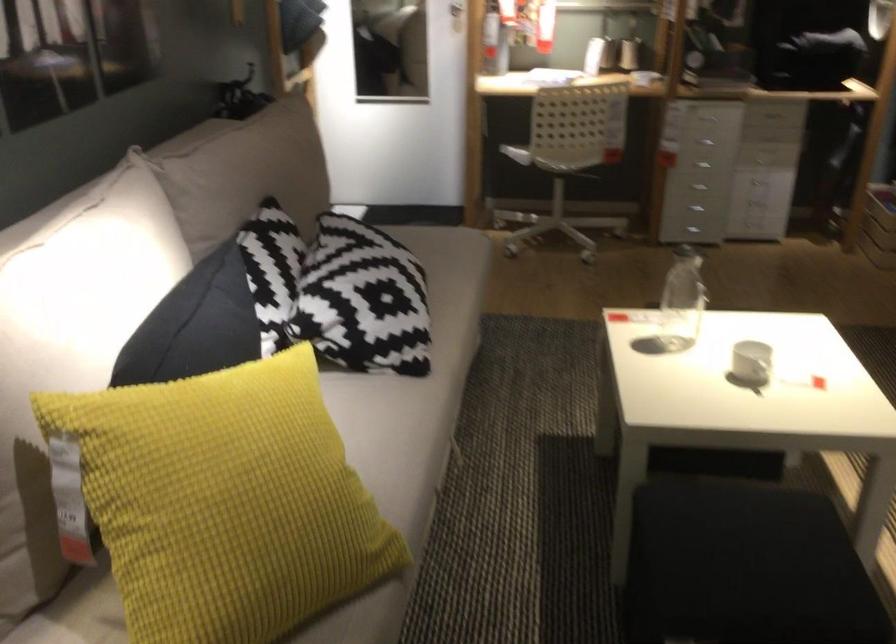
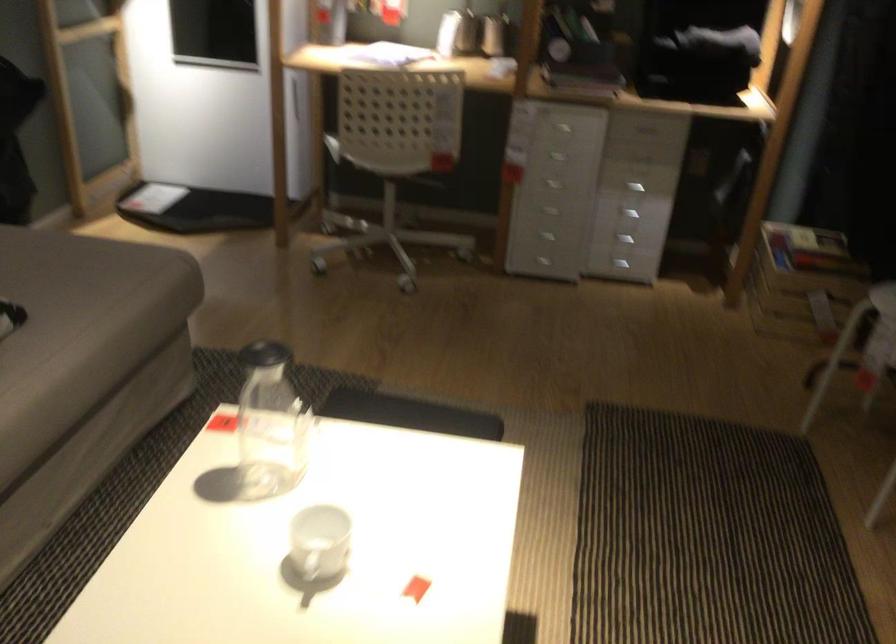
In the second image, find the point that corresponds to point (648, 326) in the first image.

(270, 424)